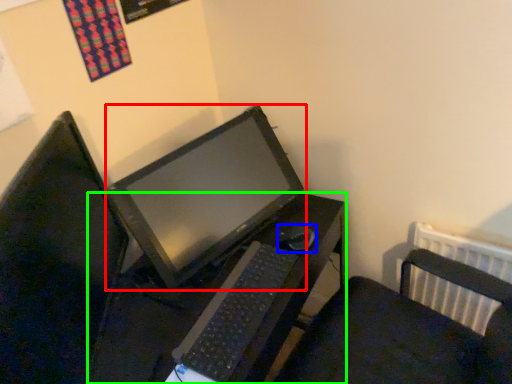
Question: Considering the real-world distances, which object is closest to table (highlighted by a red box)? mouse (highlighted by a blue box) or desk (highlighted by a green box).

Choices:
 (A) mouse
 (B) desk

Answer: (B)